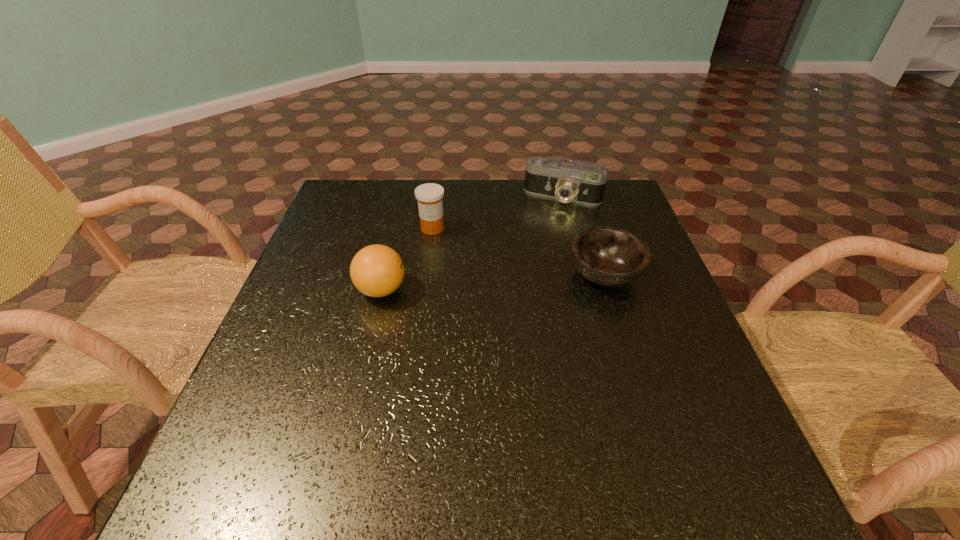
Image resolution: width=960 pixels, height=540 pixels. In order to click on free space on the desktop that is between the leftmost object and the shortest object and is positioned on the lens of the camera in this screenshot , I will do `click(526, 280)`.

Locate an element on the screen. This screenshot has width=960, height=540. vacant space on the desktop that is between the ping-pong ball and the bowl and is positioned on the label of the second object from left to right is located at coordinates (471, 284).